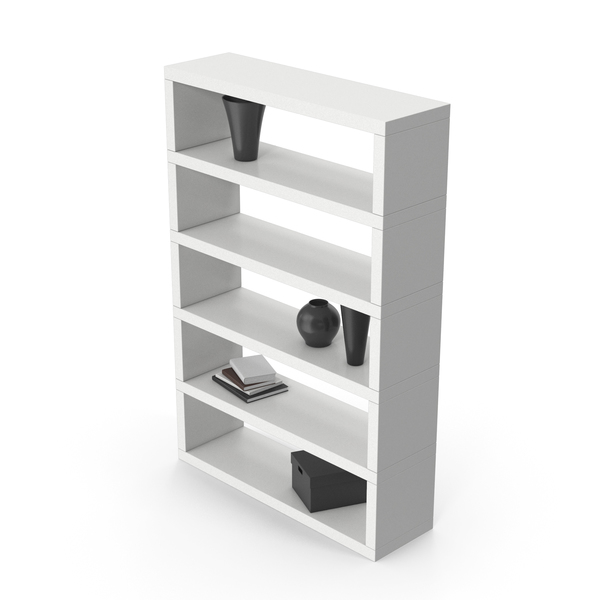
Where is `shelves`? This screenshot has height=600, width=600. shelves is located at coordinates (304, 190), (261, 260), (241, 320), (256, 419).